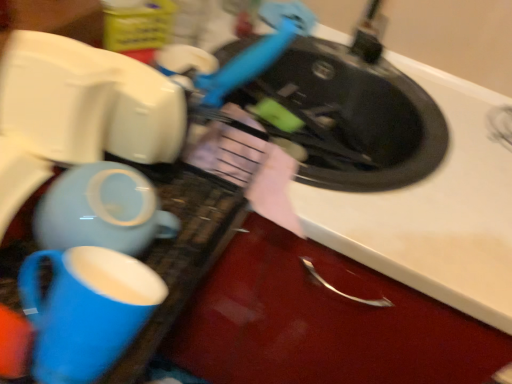
This screenshot has height=384, width=512. Describe the element at coordinates (78, 112) in the screenshot. I see `matte ceramic teapot at lower left` at that location.

Image resolution: width=512 pixels, height=384 pixels. Find the location of `white matte sink at upper right`. white matte sink at upper right is located at coordinates (434, 211).

Identify the location of matte ceramic mug at lower left. The width and height of the screenshot is (512, 384). (86, 310).

Between matte ceramic mug at lower left and white matte sink at upper right, which one is positioned behind?

white matte sink at upper right is behind.

Is matte ceramic mug at lower left next to white matte sink at upper right and touching it?

matte ceramic mug at lower left is not next to white matte sink at upper right, and they're not touching.

How many degrees apart are the facing directions of matte ceramic mug at lower left and white matte sink at upper right?

There is a 94.3-degree angle between the facing directions of matte ceramic mug at lower left and white matte sink at upper right.

From the picture: From the image's perspective, is matte ceramic mug at lower left on top of matte ceramic teapot at lower left?

No, from the image's perspective, matte ceramic mug at lower left is not over matte ceramic teapot at lower left.

Looking at this image, how different are the orientations of matte ceramic mug at lower left and matte ceramic teapot at lower left in degrees?

The angular difference between matte ceramic mug at lower left and matte ceramic teapot at lower left is 0.000895 degrees.

Between point (70, 290) and point (28, 36), which one is positioned behind?

The point (28, 36) is behind.

From the picture: Considering the sizes of matte ceramic teapot at lower left and white matte sink at upper right in the image, is matte ceramic teapot at lower left taller or shorter than white matte sink at upper right?

Considering their sizes, matte ceramic teapot at lower left has less height than white matte sink at upper right.

Is matte ceramic teapot at lower left to the right of white matte sink at upper right from the viewer's perspective?

In fact, matte ceramic teapot at lower left is to the left of white matte sink at upper right.

Is matte ceramic teapot at lower left completely or partially outside of white matte sink at upper right?

matte ceramic teapot at lower left is positioned outside white matte sink at upper right.

From a real-world perspective, which object stands above the other?

matte ceramic teapot at lower left.

Can you confirm if matte ceramic teapot at lower left is thinner than matte ceramic mug at lower left?

In fact, matte ceramic teapot at lower left might be wider than matte ceramic mug at lower left.

In the scene shown: Is matte ceramic teapot at lower left looking in the opposite direction of matte ceramic mug at lower left?

No, matte ceramic teapot at lower left's orientation is not away from matte ceramic mug at lower left.

Locate an element on the screen. This screenshot has width=512, height=384. coffee cup lying on the right of matte ceramic teapot at lower left is located at coordinates (86, 310).

From their relative heights in the image, would you say matte ceramic teapot at lower left is taller or shorter than matte ceramic mug at lower left?

matte ceramic teapot at lower left is shorter than matte ceramic mug at lower left.

Does white matte sink at upper right have a larger size compared to matte ceramic teapot at lower left?

Indeed, white matte sink at upper right has a larger size compared to matte ceramic teapot at lower left.

Is white matte sink at upper right oriented towards matte ceramic teapot at lower left?

No, white matte sink at upper right does not turn towards matte ceramic teapot at lower left.

Visually, is white matte sink at upper right positioned to the left or to the right of matte ceramic teapot at lower left?

white matte sink at upper right is positioned on matte ceramic teapot at lower left's right side.

Could matte ceramic teapot at lower left be considered to be inside white matte sink at upper right?

No, matte ceramic teapot at lower left is not inside white matte sink at upper right.

At what (x,y) coordinates should I click in order to perform the action: click on coffee cup above the white matte sink at upper right (from a real-world perspective). Please return your answer as a coordinate pair (x, y). Looking at the image, I should click on (86, 310).

Is white matte sink at upper right facing away from matte ceramic mug at lower left?

No, matte ceramic mug at lower left is not at the back of white matte sink at upper right.

From the image's perspective, is white matte sink at upper right on matte ceramic mug at lower left?

Yes, from the image's perspective, white matte sink at upper right is on top of matte ceramic mug at lower left.

Is white matte sink at upper right wider than matte ceramic mug at lower left?

Yes, white matte sink at upper right is wider than matte ceramic mug at lower left.

Identify the location of counter top that appears on the right of matte ceramic mug at lower left. (434, 211).

The width and height of the screenshot is (512, 384). What are the coordinates of `appliance behind the matte ceramic mug at lower left` in the screenshot? It's located at (78, 112).

From the image, which object appears to be nearer to white matte sink at upper right, matte ceramic mug at lower left or matte ceramic teapot at lower left?

Based on the image, matte ceramic teapot at lower left appears to be nearer to white matte sink at upper right.

Estimate the real-world distances between objects in this image. Which object is closer to white matte sink at upper right, matte ceramic teapot at lower left or matte ceramic mug at lower left?

Among the two, matte ceramic teapot at lower left is located nearer to white matte sink at upper right.

Which object lies further to the anchor point matte ceramic teapot at lower left, matte ceramic mug at lower left or white matte sink at upper right?

Based on the image, white matte sink at upper right appears to be further to matte ceramic teapot at lower left.

From the image, which object appears to be nearer to matte ceramic mug at lower left, white matte sink at upper right or matte ceramic teapot at lower left?

matte ceramic teapot at lower left is positioned closer to the anchor matte ceramic mug at lower left.

Looking at the image, which one is located closer to matte ceramic teapot at lower left, white matte sink at upper right or matte ceramic mug at lower left?

matte ceramic mug at lower left is positioned closer to the anchor matte ceramic teapot at lower left.

Based on their spatial positions, is matte ceramic teapot at lower left or white matte sink at upper right closer to matte ceramic mug at lower left?

Based on the image, matte ceramic teapot at lower left appears to be nearer to matte ceramic mug at lower left.

Where is `coffee cup located between matte ceramic teapot at lower left and white matte sink at upper right in the left-right direction`? This screenshot has height=384, width=512. coffee cup located between matte ceramic teapot at lower left and white matte sink at upper right in the left-right direction is located at coordinates (86, 310).